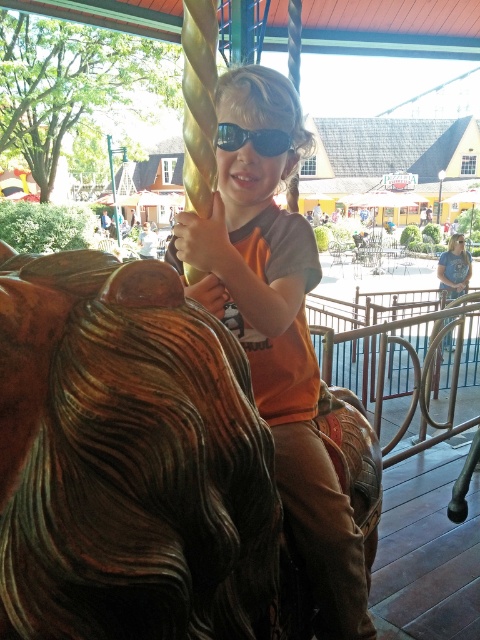
Who is more distant from viewer, [226,253] or [282,140]?

Point [282,140]

Between orange matte shirt at center and black reflective sunglasses at center, which one appears on the right side from the viewer's perspective?

orange matte shirt at center is more to the right.

Between point (347, 636) and point (229, 124), which one is positioned in front?

Point (229, 124)

Image resolution: width=480 pixels, height=640 pixels. In order to click on orange matte shirt at center in this screenshot , I will do `click(278, 336)`.